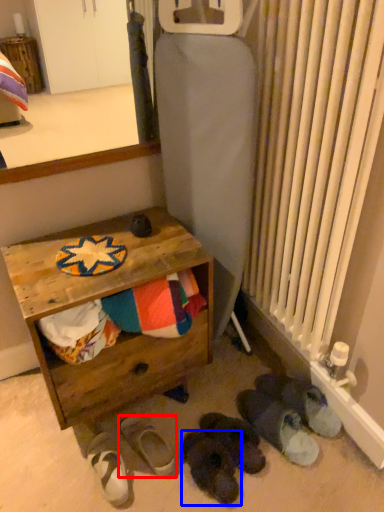
Question: Which object appears closest to the camera in this image, footwear (highlighted by a red box) or footwear (highlighted by a blue box)?

Choices:
 (A) footwear
 (B) footwear

Answer: (B)